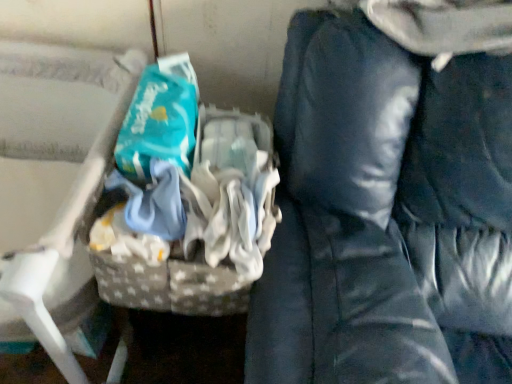
The image size is (512, 384). Describe the element at coordinates (391, 199) in the screenshot. I see `dark blue fabric bean bag chair at right` at that location.

The height and width of the screenshot is (384, 512). I want to click on gray fabric basket at left, so click(x=54, y=184).

Is point (100, 110) closer to viewer compared to point (163, 218)?

No, (100, 110) is further to viewer.

In the image, is gray fabric basket at left on the left side or the right side of teal fabric wipes at center?

gray fabric basket at left is positioned on teal fabric wipes at center's left side.

Which is in front, gray fabric basket at left or teal fabric wipes at center?

gray fabric basket at left is in front.

In terms of height, does gray fabric basket at left look taller or shorter compared to teal fabric wipes at center?

Considering their sizes, gray fabric basket at left has more height than teal fabric wipes at center.

In the scene shown: Does teal fabric wipes at center turn towards dark blue fabric bean bag chair at right?

No, teal fabric wipes at center is not oriented towards dark blue fabric bean bag chair at right.

Who is smaller, teal fabric wipes at center or dark blue fabric bean bag chair at right?

teal fabric wipes at center.

Considering the relative positions of teal fabric wipes at center and dark blue fabric bean bag chair at right in the image provided, is teal fabric wipes at center to the right of dark blue fabric bean bag chair at right from the viewer's perspective?

No.

You are a GUI agent. You are given a task and a screenshot of the screen. Output one action in this format:
    pyautogui.click(x=<x>, y=<y>)
    Task: Click on the bean bag chair below the teal fabric wipes at center (from a real-world perspective)
    The image size is (512, 384).
    Given the screenshot: What is the action you would take?
    pyautogui.click(x=391, y=199)

What's the angular difference between dark blue fabric bean bag chair at right and teal fabric wipes at center's facing directions?

The angle between the facing direction of dark blue fabric bean bag chair at right and the facing direction of teal fabric wipes at center is 0.53 degrees.

Is dark blue fabric bean bag chair at right directly adjacent to teal fabric wipes at center?

No, dark blue fabric bean bag chair at right is not in contact with teal fabric wipes at center.

Is teal fabric wipes at center a part of dark blue fabric bean bag chair at right?

No, teal fabric wipes at center is not surrounded by dark blue fabric bean bag chair at right.

Is dark blue fabric bean bag chair at right oriented towards teal fabric wipes at center?

No, dark blue fabric bean bag chair at right is not facing towards teal fabric wipes at center.

Can you confirm if gray fabric basket at left is taller than dark blue fabric bean bag chair at right?

In fact, gray fabric basket at left may be shorter than dark blue fabric bean bag chair at right.

Considering the sizes of objects gray fabric basket at left and dark blue fabric bean bag chair at right in the image provided, who is smaller, gray fabric basket at left or dark blue fabric bean bag chair at right?

Smaller between the two is gray fabric basket at left.

Which point is more forward, (73, 191) or (294, 220)?

Positioned in front is point (73, 191).

Considering the sizes of gray fabric basket at left and dark blue fabric bean bag chair at right in the image, is gray fabric basket at left wider or thinner than dark blue fabric bean bag chair at right?

Clearly, gray fabric basket at left has less width compared to dark blue fabric bean bag chair at right.

Is point (147, 247) in front of point (124, 63)?

Yes, point (147, 247) is in front of point (124, 63).

From the picture: Who is shorter, teal fabric wipes at center or gray fabric basket at left?

teal fabric wipes at center is shorter.

Where is `furniture below the teal fabric wipes at center (from the image's perspective)`? The width and height of the screenshot is (512, 384). furniture below the teal fabric wipes at center (from the image's perspective) is located at coordinates (54, 184).

Does teal fabric wipes at center have a greater width compared to gray fabric basket at left?

No, teal fabric wipes at center is not wider than gray fabric basket at left.

Is dark blue fabric bean bag chair at right shorter than gray fabric basket at left?

No.

Would you consider dark blue fabric bean bag chair at right to be distant from gray fabric basket at left?

No.

Considering the relative positions of dark blue fabric bean bag chair at right and gray fabric basket at left in the image provided, is dark blue fabric bean bag chair at right to the left of gray fabric basket at left from the viewer's perspective?

No, dark blue fabric bean bag chair at right is not to the left of gray fabric basket at left.

The width and height of the screenshot is (512, 384). Identify the location of furniture below the teal fabric wipes at center (from a real-world perspective). (54, 184).

This screenshot has width=512, height=384. In order to click on waste lying on the left of dark blue fabric bean bag chair at right in this screenshot , I will do `click(196, 223)`.

Based on their spatial positions, is teal fabric wipes at center or gray fabric basket at left closer to dark blue fabric bean bag chair at right?

teal fabric wipes at center is positioned closer to the anchor dark blue fabric bean bag chair at right.

Based on their spatial positions, is gray fabric basket at left or teal fabric wipes at center further from dark blue fabric bean bag chair at right?

gray fabric basket at left is positioned further to the anchor dark blue fabric bean bag chair at right.

From the image, which object appears to be nearer to gray fabric basket at left, dark blue fabric bean bag chair at right or teal fabric wipes at center?

teal fabric wipes at center.

From the image, which object appears to be nearer to teal fabric wipes at center, gray fabric basket at left or dark blue fabric bean bag chair at right?

The object closer to teal fabric wipes at center is dark blue fabric bean bag chair at right.

Looking at the image, which one is located further to gray fabric basket at left, teal fabric wipes at center or dark blue fabric bean bag chair at right?

dark blue fabric bean bag chair at right lies further to gray fabric basket at left than the other object.

From the image, which object appears to be farther from teal fabric wipes at center, dark blue fabric bean bag chair at right or gray fabric basket at left?

gray fabric basket at left lies further to teal fabric wipes at center than the other object.

This screenshot has height=384, width=512. What are the coordinates of `waste between gray fabric basket at left and dark blue fabric bean bag chair at right from left to right` in the screenshot? It's located at (196, 223).